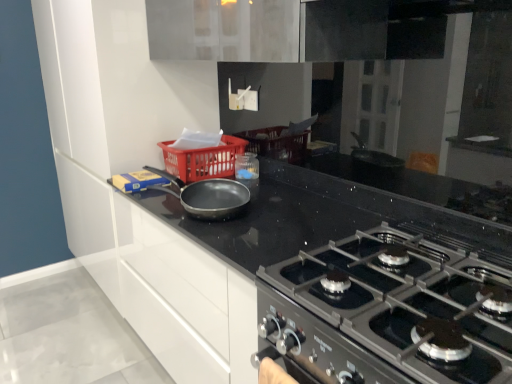
Question: Does black granite countertop at center have a larger size compared to plastic basket at center?

Choices:
 (A) yes
 (B) no

Answer: (A)

Question: Does black granite countertop at center have a lesser width compared to plastic basket at center?

Choices:
 (A) no
 (B) yes

Answer: (A)

Question: Considering the relative sizes of black granite countertop at center and plastic basket at center in the image provided, is black granite countertop at center wider than plastic basket at center?

Choices:
 (A) no
 (B) yes

Answer: (B)

Question: Is black granite countertop at center at the left side of plastic basket at center?

Choices:
 (A) yes
 (B) no

Answer: (B)

Question: Does black granite countertop at center have a smaller size compared to plastic basket at center?

Choices:
 (A) yes
 (B) no

Answer: (B)

Question: From the image's perspective, is black granite countertop at center under plastic basket at center?

Choices:
 (A) yes
 (B) no

Answer: (A)

Question: Is matte black frying pan at center thinner than black matte gas stove at center?

Choices:
 (A) yes
 (B) no

Answer: (A)

Question: Considering the relative sizes of matte black frying pan at center and black matte gas stove at center in the image provided, is matte black frying pan at center smaller than black matte gas stove at center?

Choices:
 (A) no
 (B) yes

Answer: (B)

Question: Is matte black frying pan at center taller than black matte gas stove at center?

Choices:
 (A) no
 (B) yes

Answer: (A)

Question: Is matte black frying pan at center at the left side of black matte gas stove at center?

Choices:
 (A) no
 (B) yes

Answer: (B)

Question: From a real-world perspective, is matte black frying pan at center on top of black matte gas stove at center?

Choices:
 (A) yes
 (B) no

Answer: (A)

Question: Is matte black frying pan at center facing towards black matte gas stove at center?

Choices:
 (A) yes
 (B) no

Answer: (B)

Question: Is matte black frying pan at center far from black granite countertop at center?

Choices:
 (A) no
 (B) yes

Answer: (A)